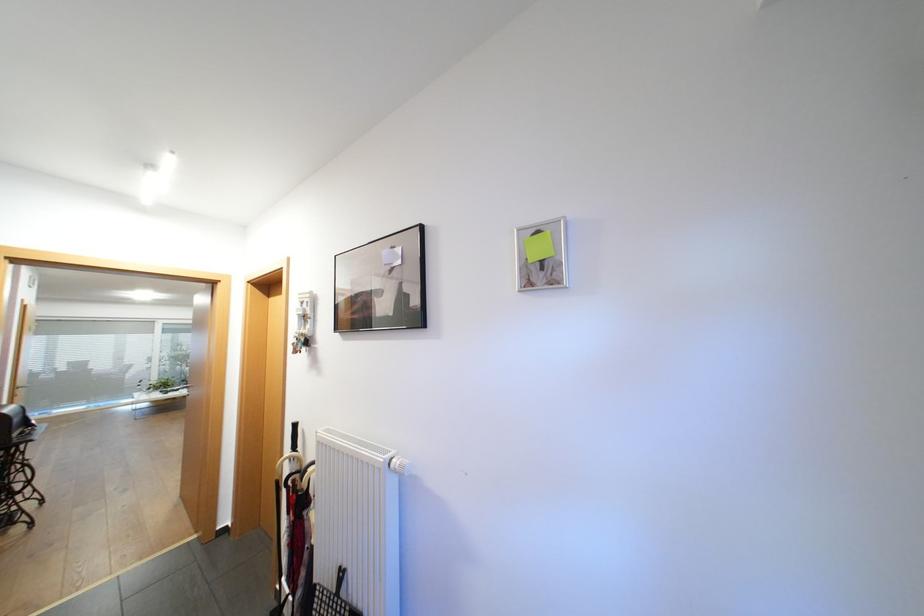
Find the location of a particular element. Image resolution: width=924 pixels, height=616 pixels. set of keys is located at coordinates coord(302,323).